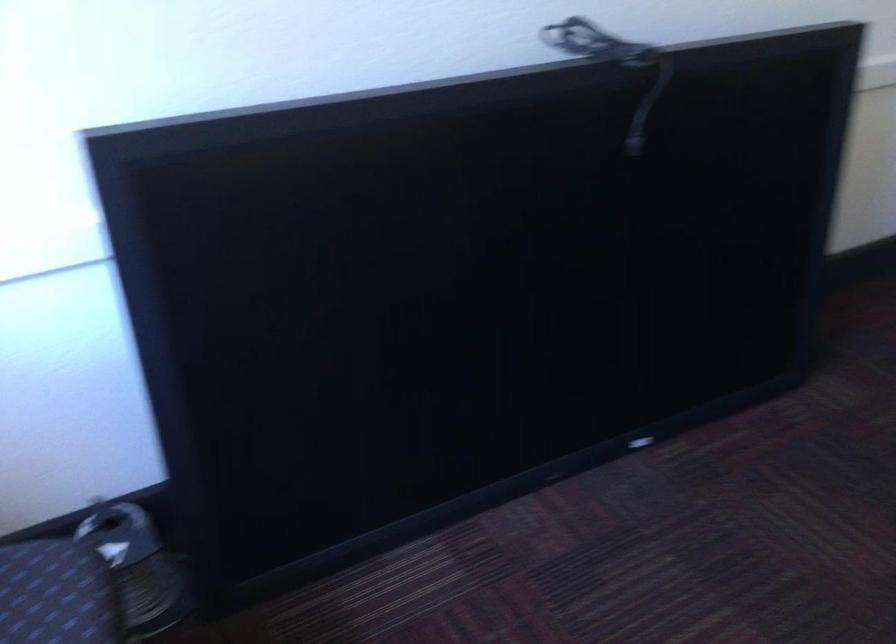
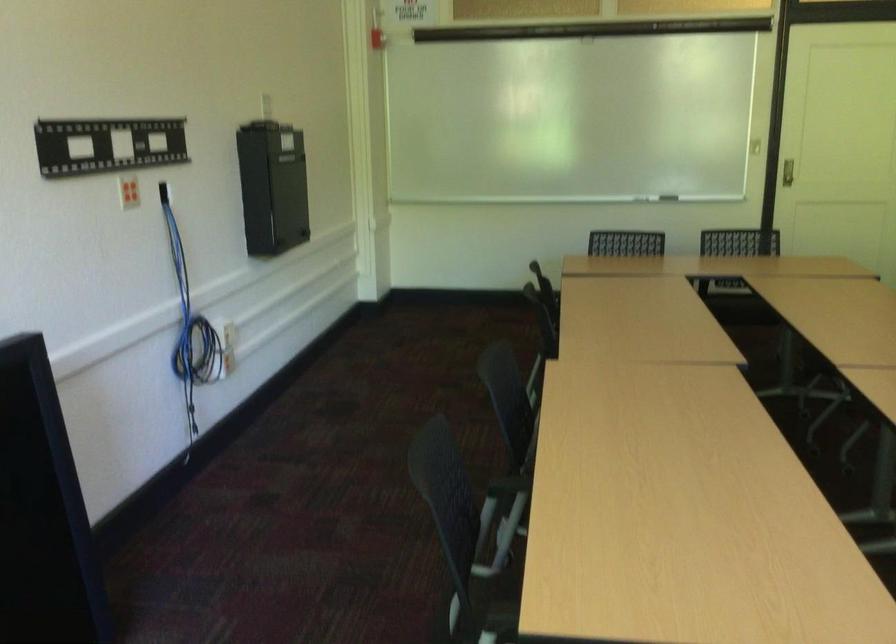
Question: The first image is from the beginning of the video and the second image is from the end. How did the camera likely rotate when shooting the video?

Choices:
 (A) Left
 (B) Right
 (C) Up
 (D) Down

Answer: (B)